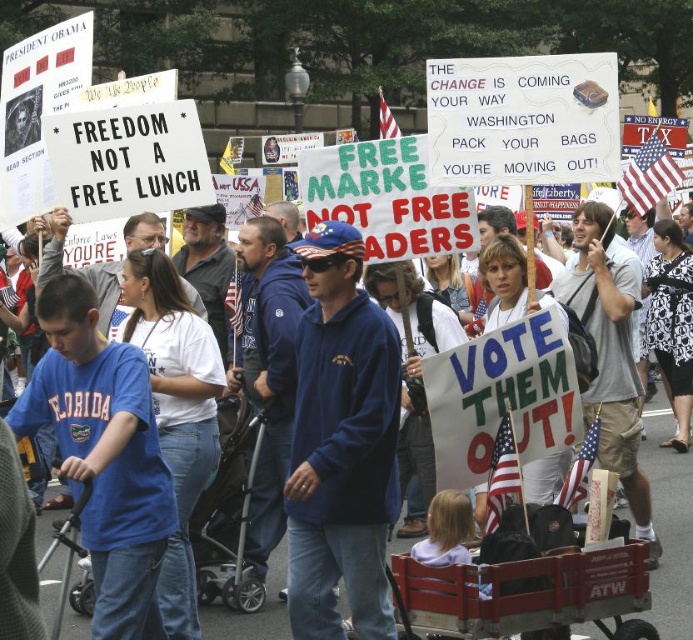
Does blue fleece jacket at center come behind blue sweatshirt at center?

No, it is not.

From the picture: Who is more forward, [389,605] or [213,625]?

Point [389,605] is more forward.

The image size is (693, 640). In order to click on blue fleece jacket at center in this screenshot , I will do click(342, 444).

Is blue fleece jacket at center bigger than blue cotton shirt at center?

Correct, blue fleece jacket at center is larger in size than blue cotton shirt at center.

The width and height of the screenshot is (693, 640). I want to click on blue fleece jacket at center, so click(342, 444).

Identify the location of blue fleece jacket at center. (342, 444).

Between blue cotton shirt at center and blue sweatshirt at center, which one appears on the left side from the viewer's perspective?

From the viewer's perspective, blue cotton shirt at center appears more on the left side.

Consider the image. Is blue cotton shirt at center wider than blue sweatshirt at center?

No.

Which is behind, point (141, 372) or point (687, 460)?

The point (687, 460) is behind.

At what (x,y) coordinates should I click in order to perform the action: click on blue cotton shirt at center. Please return your answer as a coordinate pair (x, y). Looking at the image, I should click on (103, 456).